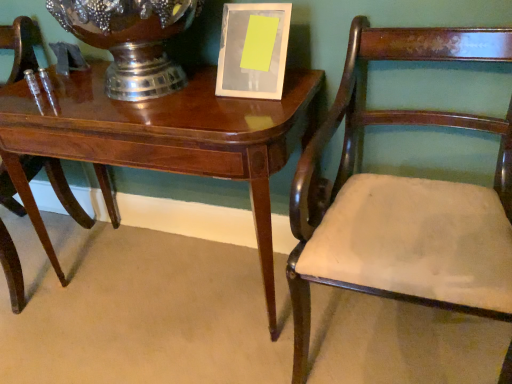
The image size is (512, 384). I want to click on vacant space underneath mahogany wood chair at right, positioned as the first chair in right-to-left order (from a real-world perspective), so click(x=390, y=342).